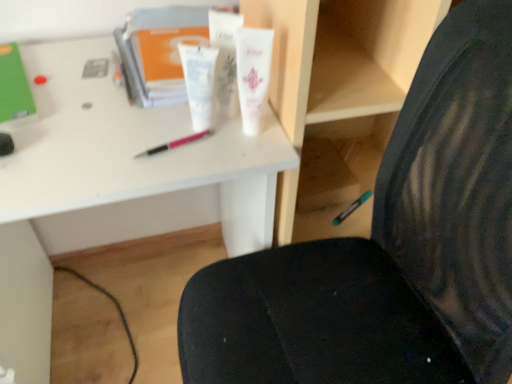
The width and height of the screenshot is (512, 384). Identify the location of vacant region to the left of white glossy tube at center, arranged as the 1th toiletry when viewed from the left. click(x=105, y=125).